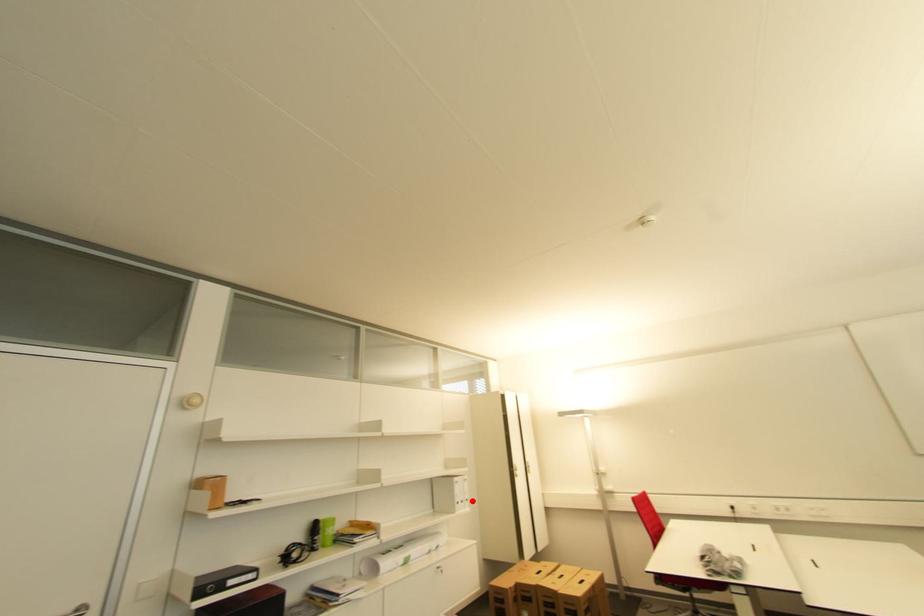
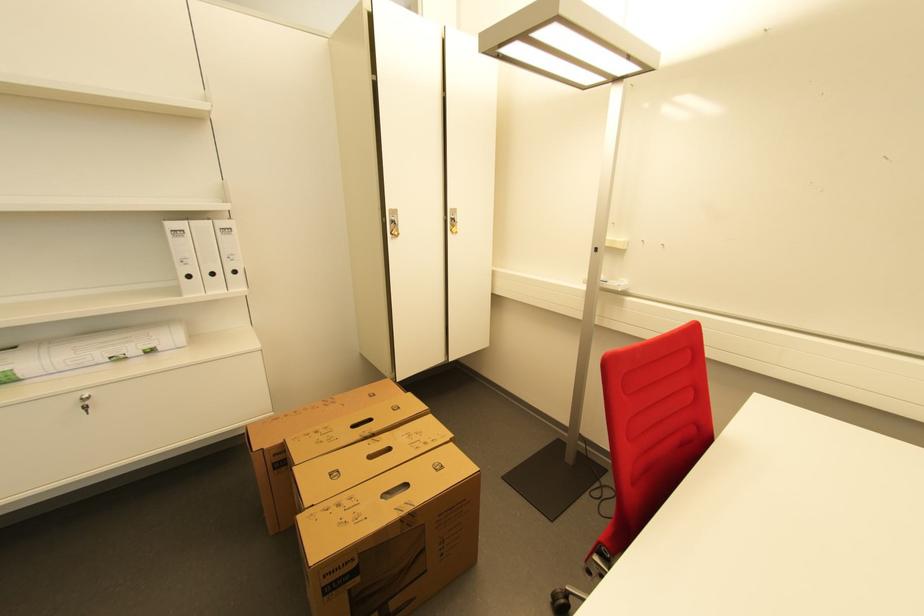
Question: I am providing you with two images of the same scene from different viewpoints. Image1 has a red point marked. In image2, the corresponding 3D location appears at what relative position? Reply with the corresponding letter.

Choices:
 (A) Closer
 (B) Farther

Answer: (A)